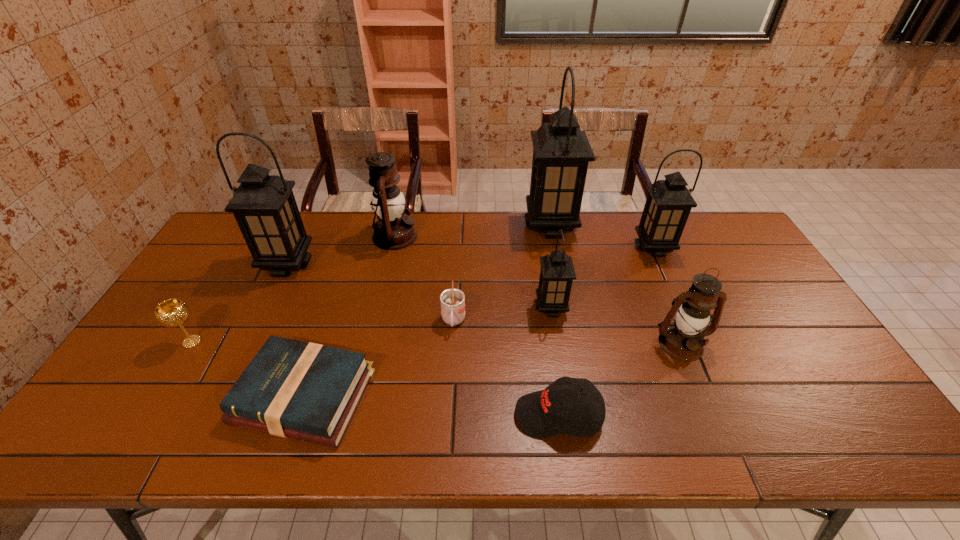
Find the location of a particular element. the biggest black lantern is located at coordinates (561, 151).

I want to click on the tallest lantern, so [561, 151].

This screenshot has width=960, height=540. Find the location of `the leftmost black lantern`. the leftmost black lantern is located at coordinates (264, 206).

Identify the location of the leftmost lantern. (264, 206).

The width and height of the screenshot is (960, 540). I want to click on the bigger brown lantern, so click(393, 231).

Where is `the left brown lantern`? The width and height of the screenshot is (960, 540). the left brown lantern is located at coordinates (393, 231).

Locate an element on the screen. The image size is (960, 540). the rightmost black lantern is located at coordinates (669, 202).

Where is `the second nearest lantern`? The width and height of the screenshot is (960, 540). the second nearest lantern is located at coordinates (557, 273).

This screenshot has height=540, width=960. I want to click on the nearest black lantern, so click(x=557, y=273).

Where is `the nearer brown lantern`? the nearer brown lantern is located at coordinates (683, 339).